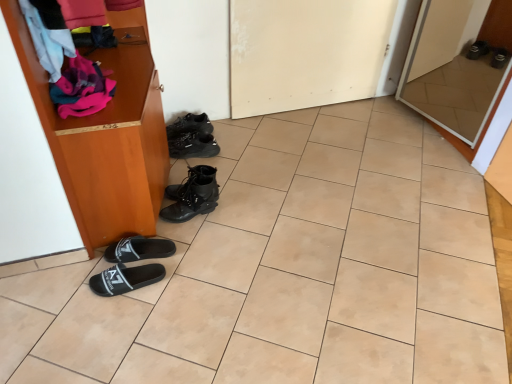
Find the location of a particular element. vacant space behind black leather sneakers at center, acting as the 4th footwear starting from the front is located at coordinates (208, 136).